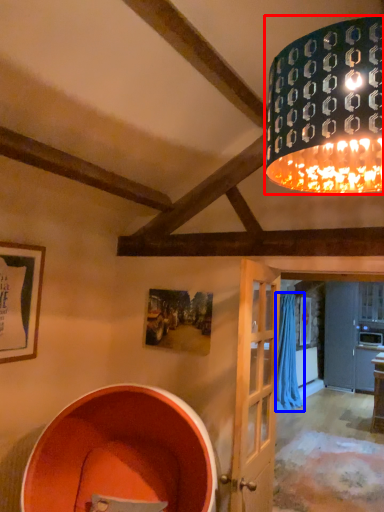
Question: Which point is further to the camera, lamp (highlighted by a red box) or curtain (highlighted by a blue box)?

Choices:
 (A) lamp
 (B) curtain

Answer: (B)